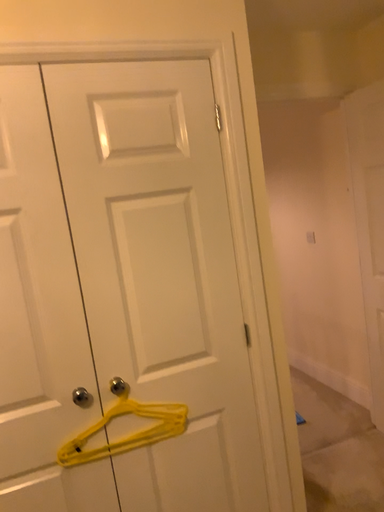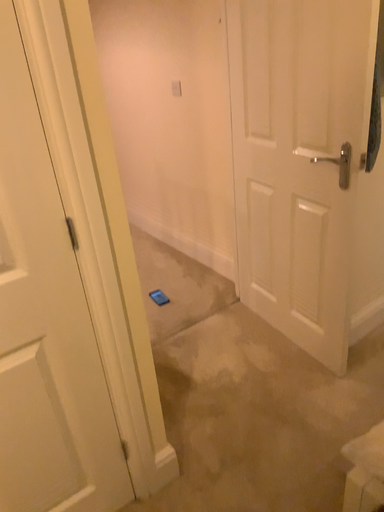
Question: Which way did the camera rotate in the video?

Choices:
 (A) rotated left
 (B) rotated right

Answer: (B)